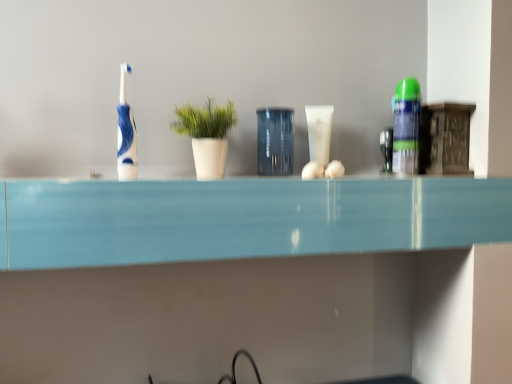
Question: Does green matte plant at center appear on the right side of transparent glass jar at center?

Choices:
 (A) yes
 (B) no

Answer: (B)

Question: From a real-world perspective, is green matte plant at center located beneath transparent glass jar at center?

Choices:
 (A) no
 (B) yes

Answer: (A)

Question: Considering the relative sizes of green matte plant at center and transparent glass jar at center in the image provided, is green matte plant at center taller than transparent glass jar at center?

Choices:
 (A) no
 (B) yes

Answer: (A)

Question: From the image's perspective, is green matte plant at center on transparent glass jar at center?

Choices:
 (A) yes
 (B) no

Answer: (B)

Question: Is transparent glass jar at center located within green matte plant at center?

Choices:
 (A) no
 (B) yes

Answer: (A)

Question: From a real-world perspective, is blue glossy toothbrush at left positioned above or below green matte plant at center?

Choices:
 (A) above
 (B) below

Answer: (A)

Question: Is blue glossy toothbrush at left in front of or behind green matte plant at center in the image?

Choices:
 (A) front
 (B) behind

Answer: (B)

Question: Choose the correct answer: Is blue glossy toothbrush at left inside green matte plant at center or outside it?

Choices:
 (A) inside
 (B) outside

Answer: (B)

Question: Does point (126, 114) appear closer or farther from the camera than point (197, 119)?

Choices:
 (A) farther
 (B) closer

Answer: (B)

Question: From their relative heights in the image, would you say transparent glass jar at center is taller or shorter than green matte plant at center?

Choices:
 (A) tall
 (B) short

Answer: (A)

Question: Based on their sizes in the image, would you say transparent glass jar at center is bigger or smaller than green matte plant at center?

Choices:
 (A) small
 (B) big

Answer: (A)

Question: Is transparent glass jar at center wider or thinner than green matte plant at center?

Choices:
 (A) thin
 (B) wide

Answer: (A)

Question: Considering the positions of point (282, 162) and point (196, 125), is point (282, 162) closer or farther from the camera than point (196, 125)?

Choices:
 (A) closer
 (B) farther

Answer: (B)

Question: Is white glossy tube at center, arranged as the 1th toiletry when viewed from the left, in front of or behind green matte plant at center in the image?

Choices:
 (A) front
 (B) behind

Answer: (B)

Question: From the image's perspective, is white glossy tube at center, the second toiletry viewed from the right, located above or below green matte plant at center?

Choices:
 (A) below
 (B) above

Answer: (B)